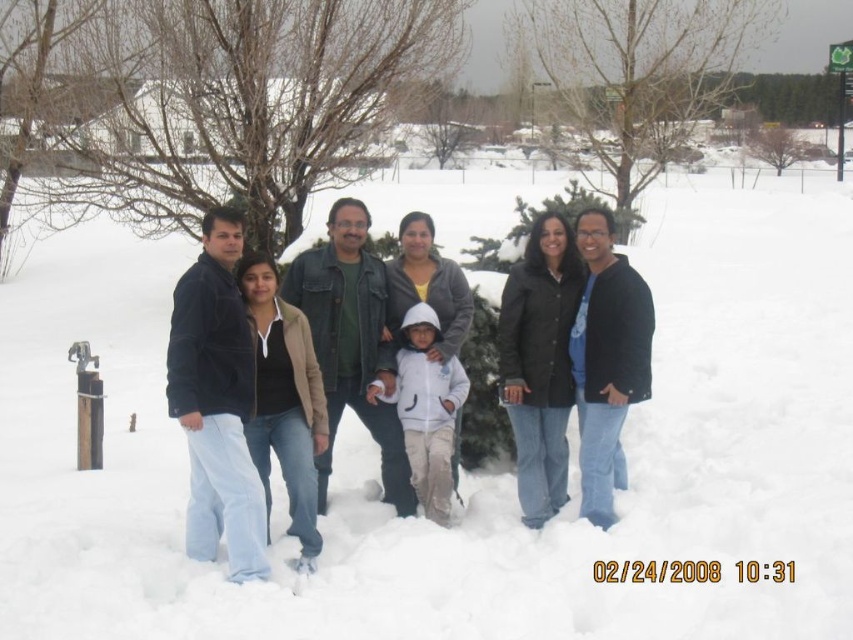
Who is higher up, dark blue jacket at center or black matte jacket at right?

black matte jacket at right is above.

Between point (339, 412) and point (611, 292), which one is positioned in front?

Point (611, 292)

Which is behind, point (213, 516) or point (592, 400)?

The point (592, 400) is more distant.

The height and width of the screenshot is (640, 853). In order to click on dark blue jacket at center in this screenshot , I will do `click(285, 358)`.